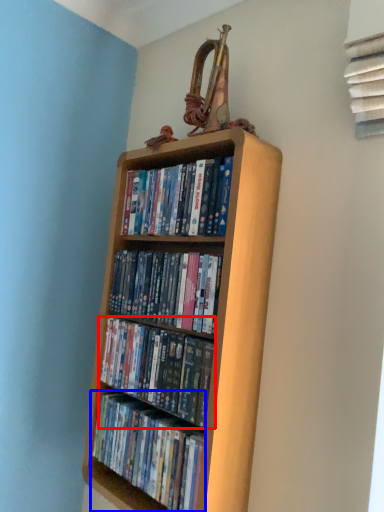
Question: Among these objects, which one is nearest to the camera, book (highlighted by a red box) or book (highlighted by a blue box)?

Choices:
 (A) book
 (B) book

Answer: (B)